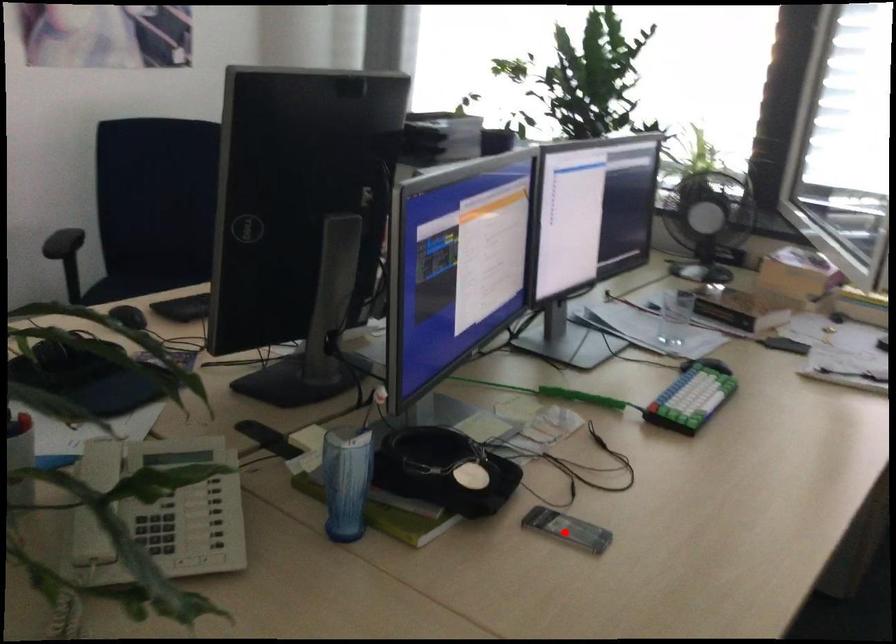
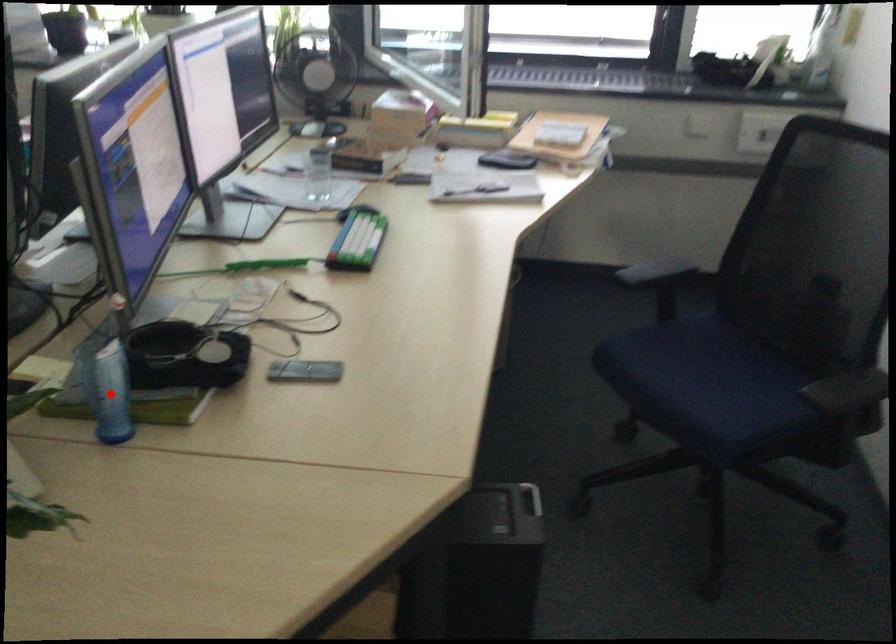
I am providing you with two images of the same scene from different viewpoints. A red point is marked on the first image and another point is marked on the second image. Does the point marked in image1 correspond to the same location as the one in image2?

No